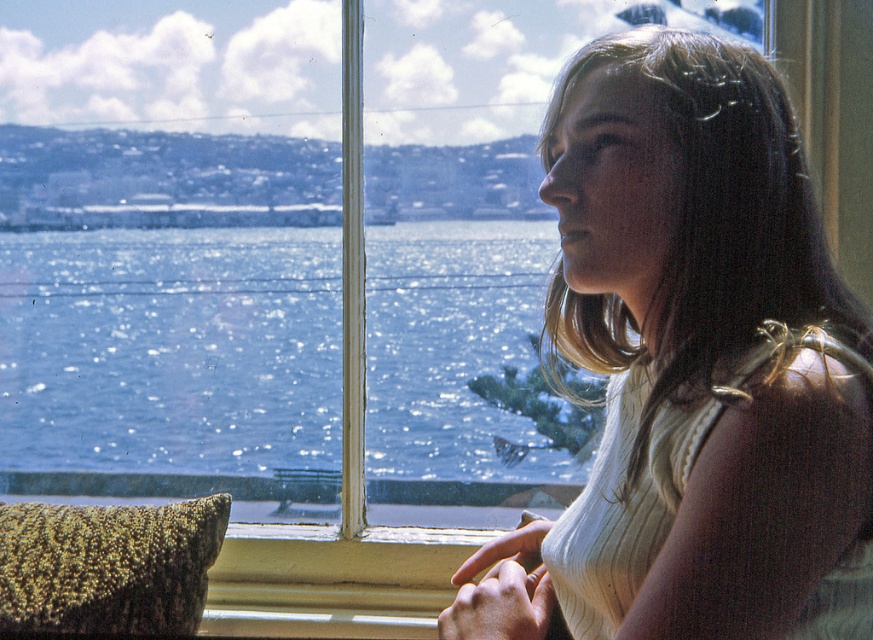
Does white ribbed tank top at center have a smaller size compared to green textured pillow at lower left?

No, white ribbed tank top at center is not smaller than green textured pillow at lower left.

Which is in front, point (732, 342) or point (179, 522)?

Point (732, 342) is more forward.

Where is `white ribbed tank top at center`? This screenshot has width=873, height=640. white ribbed tank top at center is located at coordinates (693, 364).

Does white ribbed tank top at center have a lesser height compared to sparkling blue water at window center?

No, white ribbed tank top at center is not shorter than sparkling blue water at window center.

Does white ribbed tank top at center have a larger size compared to sparkling blue water at window center?

Yes.

Who is more forward, (x=486, y=547) or (x=425, y=260)?

Point (x=486, y=547) is in front.

Identify the location of white ribbed tank top at center. The width and height of the screenshot is (873, 640). (693, 364).

Is point (167, 278) closer to viewer compared to point (47, 588)?

No, (167, 278) is behind (47, 588).

Does sparkling blue water at window center have a smaller size compared to green textured pillow at lower left?

No.

Find the location of a particular element. This screenshot has width=873, height=640. sparkling blue water at window center is located at coordinates (170, 349).